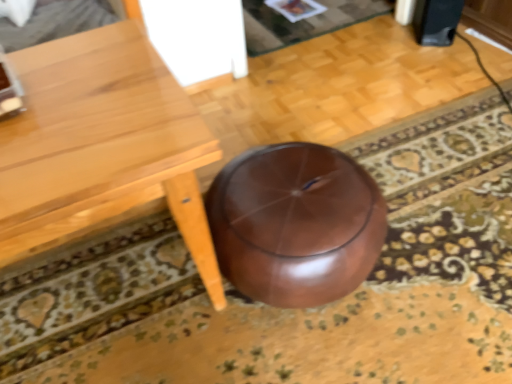
The width and height of the screenshot is (512, 384). Find the location of `free space in front of black matte speaker at upper right`. free space in front of black matte speaker at upper right is located at coordinates (450, 56).